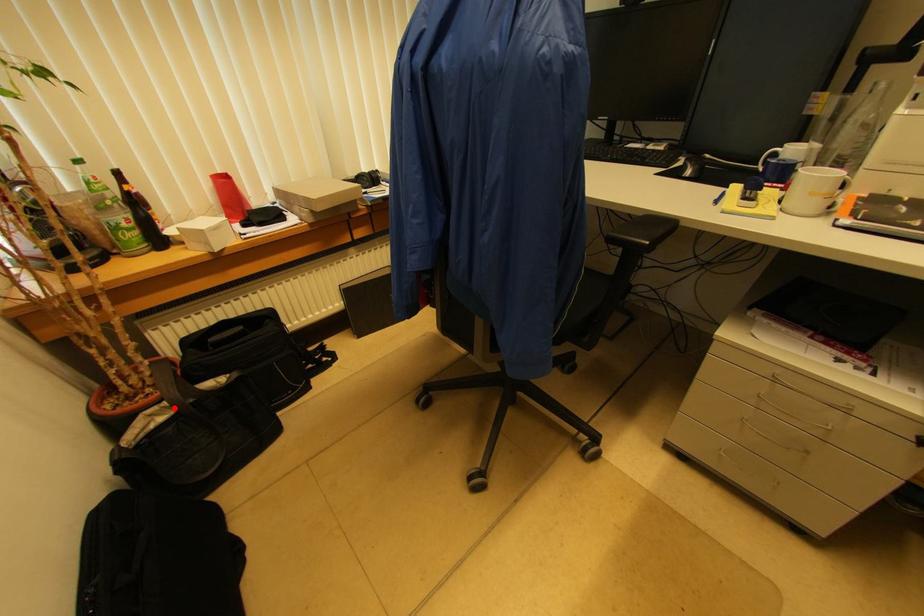
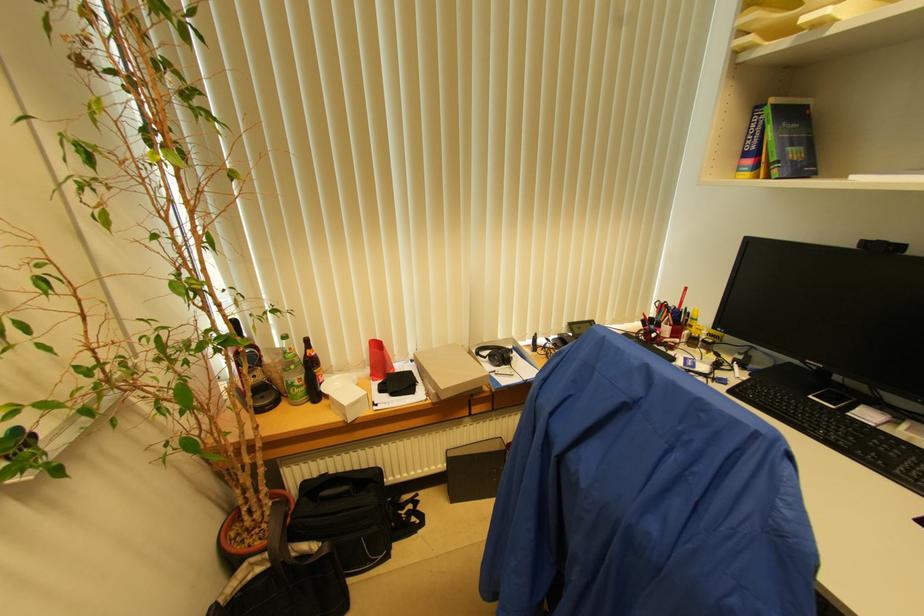
Where in the second image is the point corresponding to the highlighted location from the first image?

(273, 561)